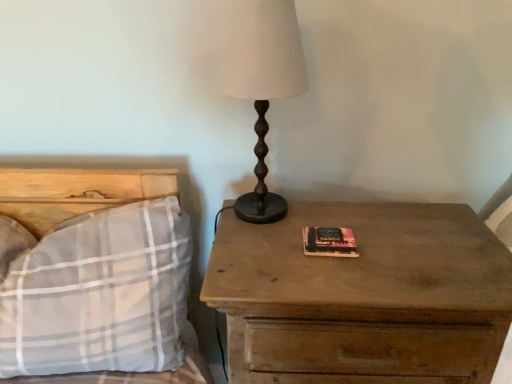
What do you see at coordinates (75, 192) in the screenshot? The height and width of the screenshot is (384, 512). I see `plaid fabric pillow at left` at bounding box center [75, 192].

Locate an element on the screen. plaid fabric pillow at left is located at coordinates (75, 192).

Which is less distant, (287, 23) or (2, 380)?

The point (287, 23) is in front.

Which of these two, matte brown table lamp at center or plaid fabric pillow at left, stands shorter?

plaid fabric pillow at left.

From a real-world perspective, is matte brown table lamp at center on top of plaid fabric pillow at left?

Indeed, from a real-world perspective, matte brown table lamp at center stands above plaid fabric pillow at left.

Would you say matte brown table lamp at center is to the left or to the right of plaid fabric pillow at left in the picture?

In the image, matte brown table lamp at center appears on the right side of plaid fabric pillow at left.

From the picture: Is wooden nightstand at right directly adjacent to plaid fabric pillow at left?

wooden nightstand at right and plaid fabric pillow at left are clearly separated.

From the image's perspective, which one is positioned lower, wooden nightstand at right or plaid fabric pillow at left?

From the image's view, wooden nightstand at right is below.

Does wooden nightstand at right have a greater height compared to plaid fabric pillow at left?

Yes, wooden nightstand at right is taller than plaid fabric pillow at left.

From the picture: From the image's perspective, which one is positioned higher, matte brown table lamp at center or wooden nightstand at right?

matte brown table lamp at center is shown above in the image.

Consider the image. Can you confirm if matte brown table lamp at center is bigger than wooden nightstand at right?

Incorrect, matte brown table lamp at center is not larger than wooden nightstand at right.

From the picture: Would you say matte brown table lamp at center is to the left or to the right of wooden nightstand at right in the picture?

Based on their positions, matte brown table lamp at center is located to the left of wooden nightstand at right.

Could you tell me if matte brown table lamp at center is facing wooden nightstand at right?

No, matte brown table lamp at center is not oriented towards wooden nightstand at right.

Is wooden nightstand at right placed right next to matte brown table lamp at center?

No, wooden nightstand at right is not making contact with matte brown table lamp at center.

Looking at this image, from the image's perspective, is wooden nightstand at right above or below matte brown table lamp at center?

wooden nightstand at right is below matte brown table lamp at center.

From their relative heights in the image, would you say wooden nightstand at right is taller or shorter than matte brown table lamp at center?

In the image, wooden nightstand at right appears to be taller than matte brown table lamp at center.

Is point (396, 321) farther from camera compared to point (266, 92)?

That is False.

Is the depth of plaid fabric pillow at left greater than that of matte brown table lamp at center?

No, plaid fabric pillow at left is in front of matte brown table lamp at center.

Would you say plaid fabric pillow at left contains matte brown table lamp at center?

No, plaid fabric pillow at left does not contain matte brown table lamp at center.

In terms of height, does plaid fabric pillow at left look taller or shorter compared to matte brown table lamp at center?

In the image, plaid fabric pillow at left appears to be shorter than matte brown table lamp at center.

From the image's perspective, between plaid fabric pillow at left and matte brown table lamp at center, which one is located above?

matte brown table lamp at center.

In terms of height, does plaid fabric pillow at left look taller or shorter compared to wooden nightstand at right?

In the image, plaid fabric pillow at left appears to be shorter than wooden nightstand at right.

Which is closer to the camera, (33, 177) or (269, 283)?

Point (33, 177) appears to be farther away from the viewer than point (269, 283).

Is plaid fabric pillow at left oriented towards wooden nightstand at right?

No, plaid fabric pillow at left is not turned towards wooden nightstand at right.

Find the location of a particular element. bed lying below the matte brown table lamp at center (from the image's perspective) is located at coordinates (75, 192).

This screenshot has height=384, width=512. Find the location of `bed that appears above the wooden nightstand at right (from the image's perspective)`. bed that appears above the wooden nightstand at right (from the image's perspective) is located at coordinates (75, 192).

From the image, which object appears to be nearer to wooden nightstand at right, plaid fabric pillow at left or matte brown table lamp at center?

matte brown table lamp at center lies closer to wooden nightstand at right than the other object.

Which object lies further to the anchor point plaid fabric pillow at left, wooden nightstand at right or matte brown table lamp at center?

wooden nightstand at right is further to plaid fabric pillow at left.

From the image, which object appears to be nearer to matte brown table lamp at center, plaid fabric pillow at left or wooden nightstand at right?

The object closer to matte brown table lamp at center is wooden nightstand at right.

Considering their positions, is wooden nightstand at right positioned closer to matte brown table lamp at center than plaid fabric pillow at left?

The object closer to matte brown table lamp at center is wooden nightstand at right.

When comparing their distances from plaid fabric pillow at left, does matte brown table lamp at center or wooden nightstand at right seem closer?

matte brown table lamp at center is closer to plaid fabric pillow at left.

When comparing their distances from wooden nightstand at right, does matte brown table lamp at center or plaid fabric pillow at left seem further?

plaid fabric pillow at left lies further to wooden nightstand at right than the other object.

Find the location of `table lamp between plaid fabric pillow at left and wooden nightstand at right from left to right`. table lamp between plaid fabric pillow at left and wooden nightstand at right from left to right is located at coordinates (x=261, y=82).